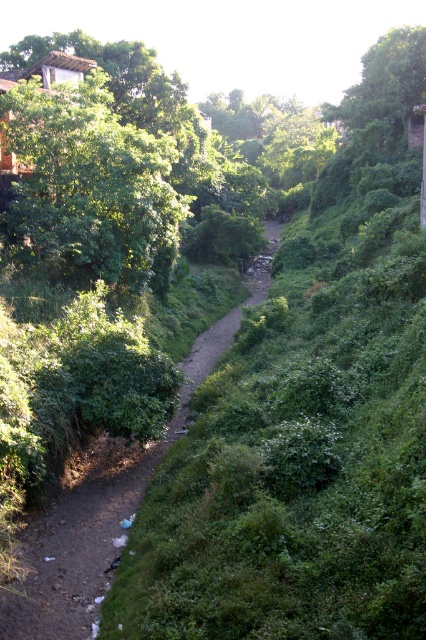
You are standing at the point labeled as point [92,522] in the image. What is the immediate surface you are standing on?

The immediate surface you are standing on is the dirt path at center, as point [92,522] corresponds to the dirt path at center according to the description.

You are a hiker with a 20 meter long rope. You want to tie the rope from your current position to the green leafy tree at upper left. Is the rope long enough to reach the tree?

The green leafy tree at upper left is 21.37 meters from camera. The rope is only 20 meters long, so it is not long enough to reach the tree.